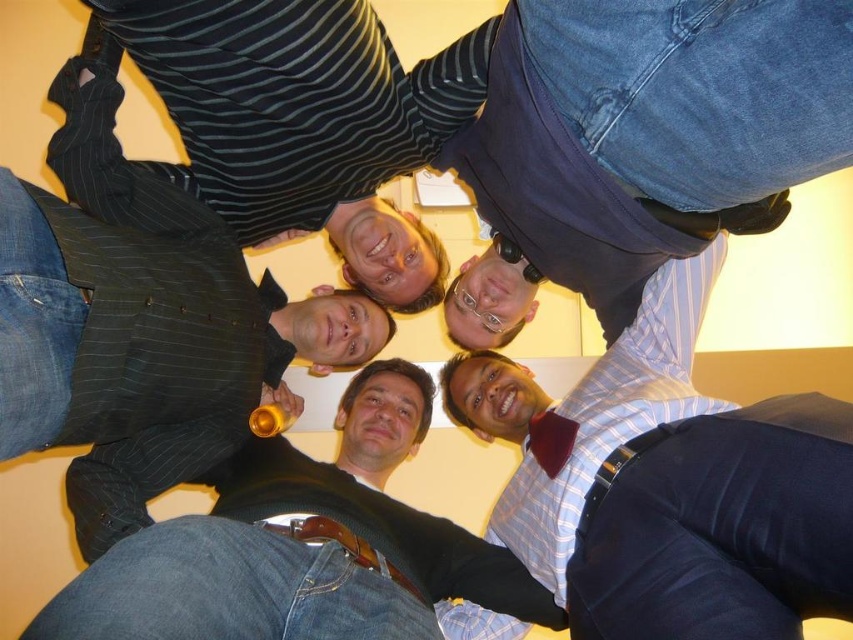
You are a photographer trying to capture a group photo. You notice the jeans at center and the blue striped shirt at center in your frame. Given that your camera has a minimum focus distance of 12 inches, will you be able to focus on both objects without moving the camera or the subjects?

The distance between the jeans at center and the blue striped shirt at center is 12.53 inches, which exceeds the camera minimum focus distance of 12 inches. Therefore, the camera can focus on both objects without needing to adjust the camera or subjects.

You are a photographer trying to adjust the framing of the group photo. You notice two items in the upper center area of the image, the blue jeans at upper center and the striped fabric shirt at upper center. Which of these two items appears narrower in the photo?

The blue jeans at upper center appears narrower than the striped fabric shirt at upper center, as it has a lesser width according to the description.

You are a photographer trying to adjust the focus of your camera. You want to ensure that both the blue jeans at upper center and the striped fabric shirt at upper center are clearly visible. Which object should you focus on first to make sure both are in focus?

You should focus on the blue jeans at upper center first because it is in front of the striped fabric shirt at upper center, so focusing on the closer object will ensure both are in focus.